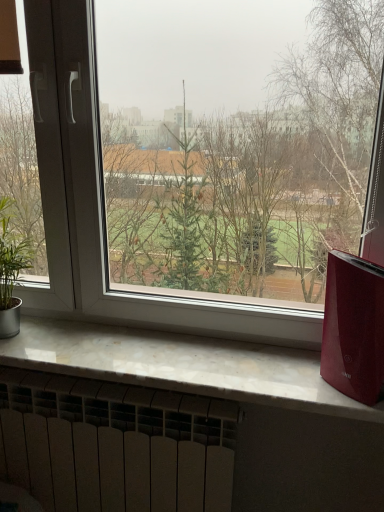
Where is `vacant area that lies to the right of green leafy plant at left`? This screenshot has height=512, width=384. vacant area that lies to the right of green leafy plant at left is located at coordinates (64, 344).